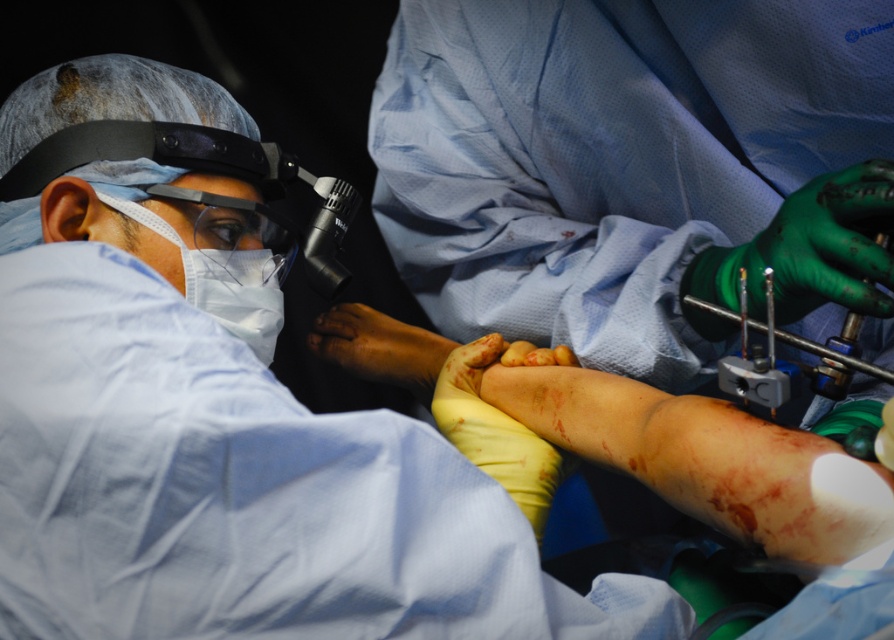
You are a medical student observing a surgical procedure. You notice two white matte masks in the scene. How far apart are the white matte mask at center and the white matte mask at left?

The white matte mask at center and the white matte mask at left are 0.25 inches apart.